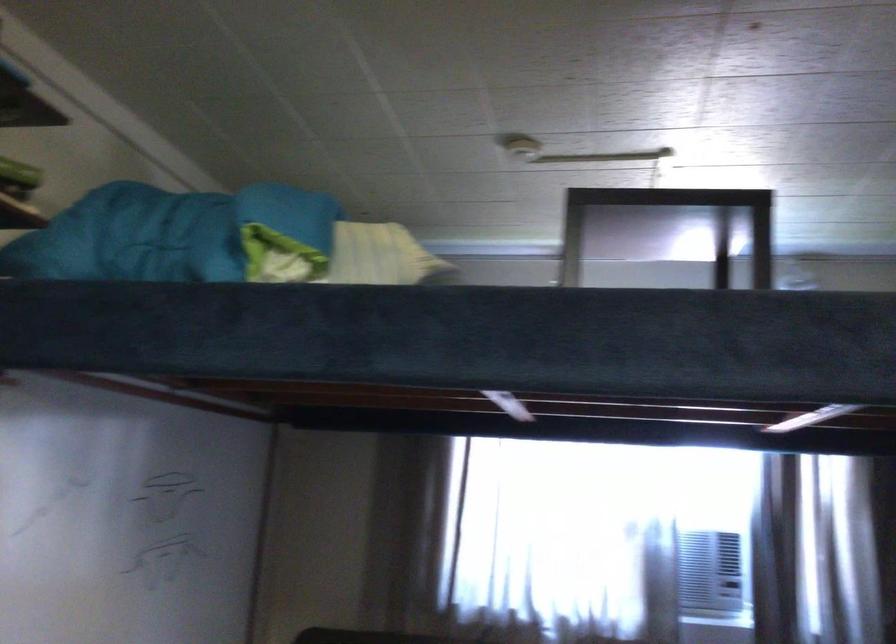
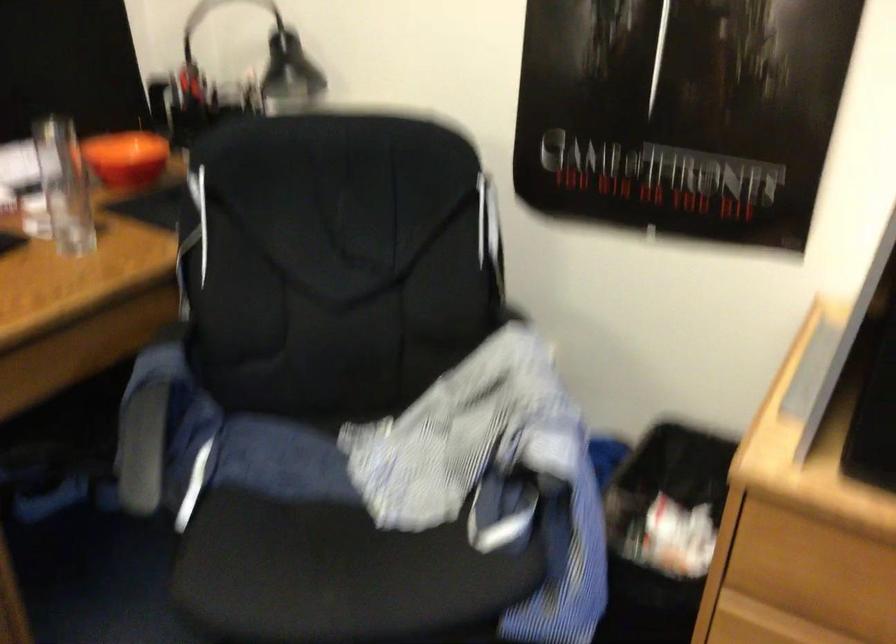
How did the camera likely rotate?

The rotation direction of the camera is left-down.